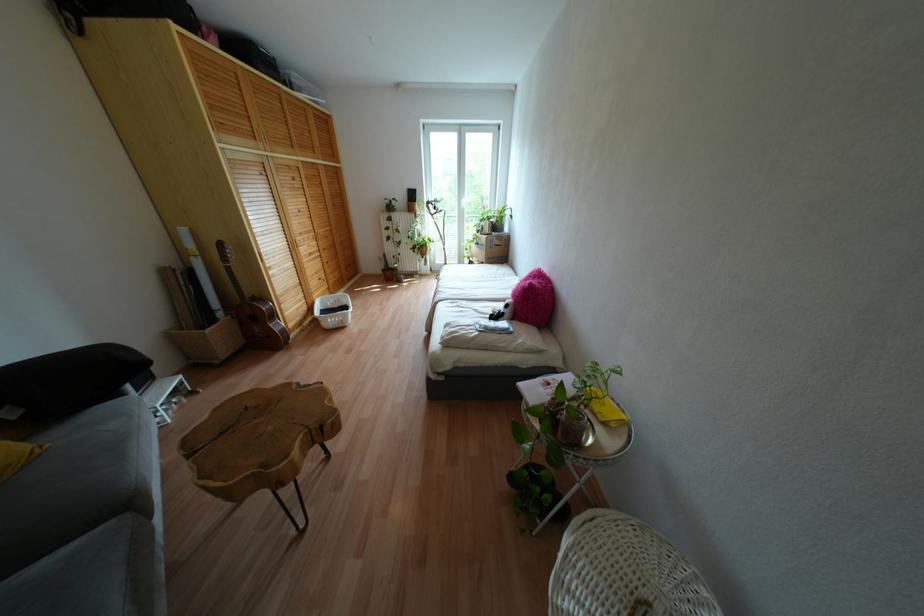
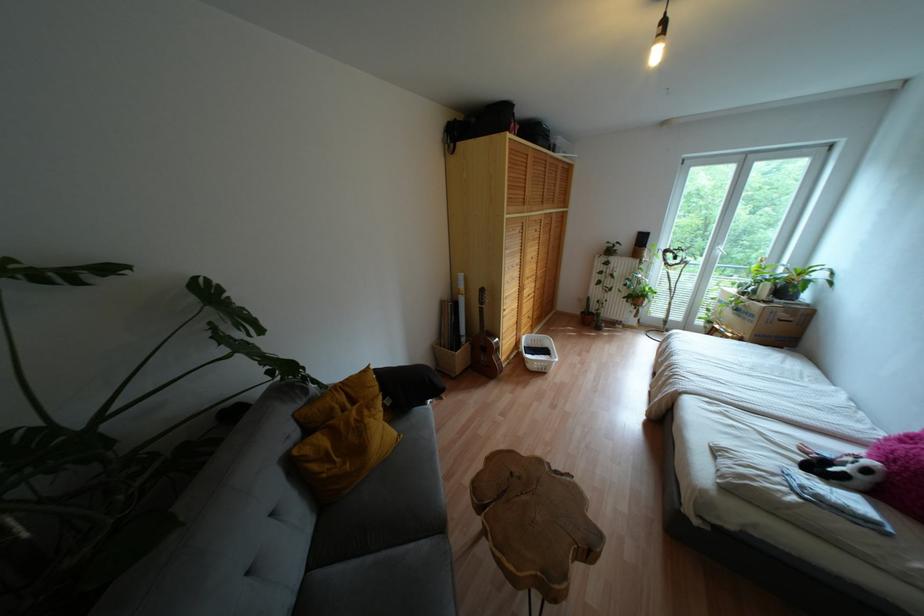
In the second image, find the point that corresponds to pixel 339 325 in the first image.

(542, 370)